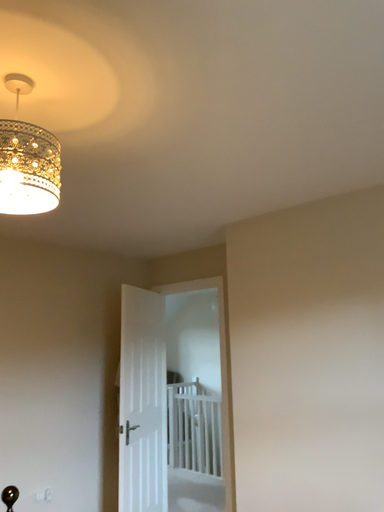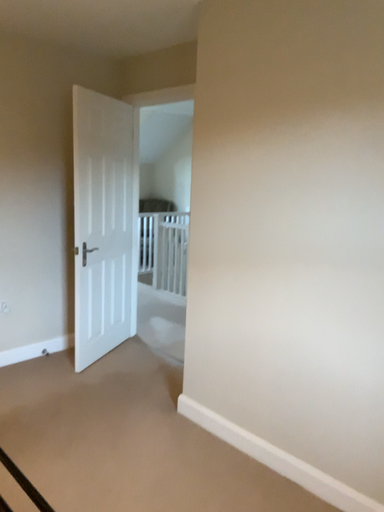
Question: How did the camera likely rotate when shooting the video?

Choices:
 (A) rotated upward
 (B) rotated downward

Answer: (B)